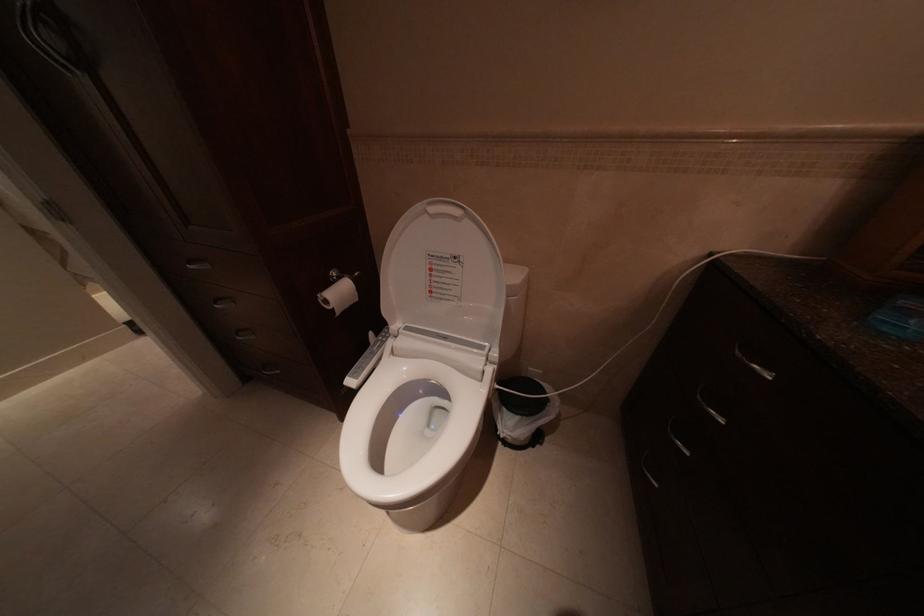
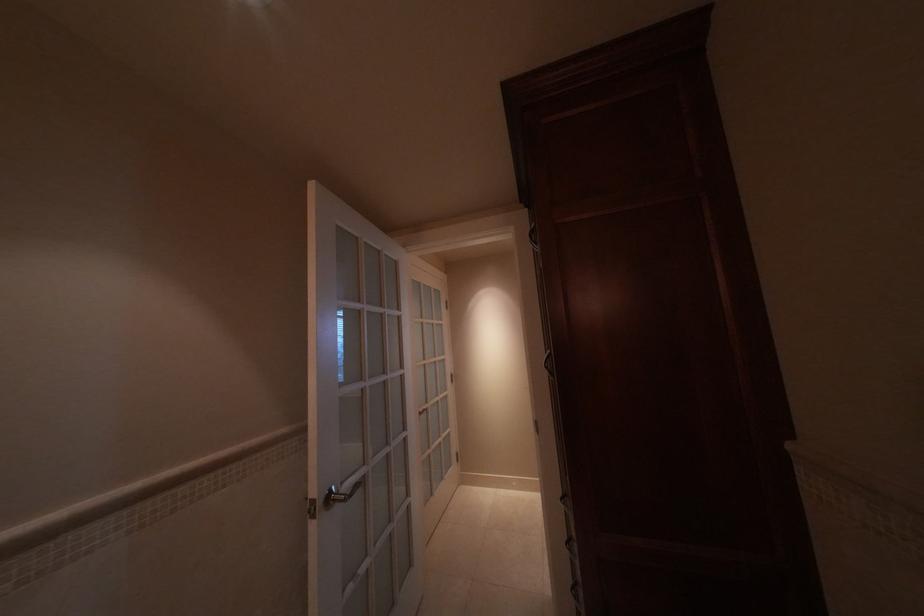
Question: The camera is either moving clockwise (left) or counter-clockwise (right) around the object. The first image is from the beginning of the video and the second image is from the end. Is the camera moving left or right when shooting the video?

Choices:
 (A) Left
 (B) Right

Answer: (B)